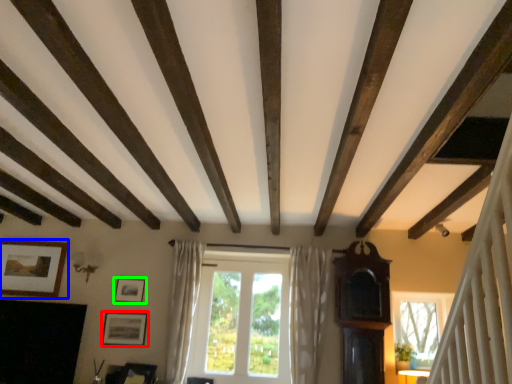
Question: Estimate the real-world distances between objects in this image. Which object is closer to picture frame (highlighted by a red box), picture frame (highlighted by a blue box) or picture frame (highlighted by a green box)?

Choices:
 (A) picture frame
 (B) picture frame

Answer: (B)